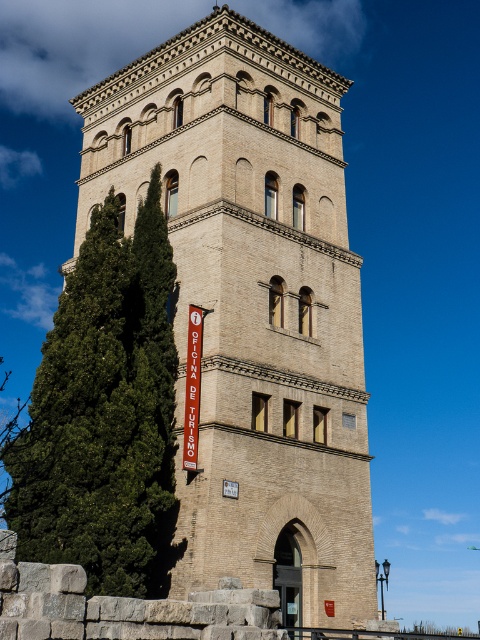
Measure the distance between beige stone tower at center and camera.

beige stone tower at center and camera are 99.57 feet apart from each other.

Is beige stone tower at center bigger than green leafy tree at left?

Correct, beige stone tower at center is larger in size than green leafy tree at left.

The height and width of the screenshot is (640, 480). What do you see at coordinates (252, 305) in the screenshot?
I see `beige stone tower at center` at bounding box center [252, 305].

Locate an element on the screen. Image resolution: width=480 pixels, height=640 pixels. beige stone tower at center is located at coordinates (252, 305).